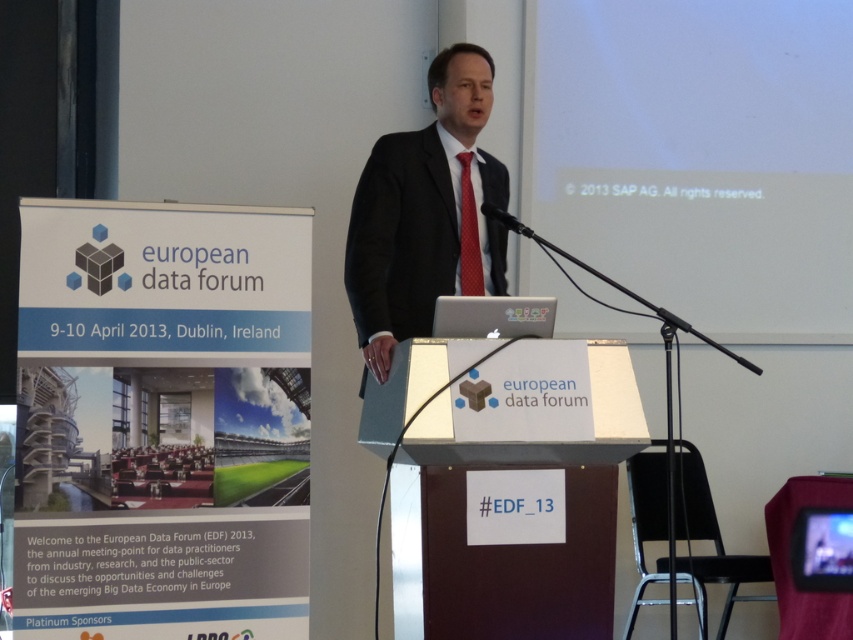
Who is more forward, (807, 198) or (474, 260)?

Point (474, 260)

Does point (611, 52) come farther from viewer compared to point (474, 260)?

Yes.

Where is `white matte projection screen at upper right`? Image resolution: width=853 pixels, height=640 pixels. white matte projection screen at upper right is located at coordinates (701, 156).

Is white plastic podium at center thinner than red dotted tie at center?

No.

Is white plastic podium at center to the right of red dotted tie at center from the viewer's perspective?

Indeed, white plastic podium at center is positioned on the right side of red dotted tie at center.

The width and height of the screenshot is (853, 640). Find the location of `white plastic podium at center`. white plastic podium at center is located at coordinates (550, 444).

Is point (807, 20) positioned in front of point (624, 342)?

No, (807, 20) is behind (624, 342).

I want to click on white matte projection screen at upper right, so click(701, 156).

The height and width of the screenshot is (640, 853). I want to click on white matte projection screen at upper right, so click(701, 156).